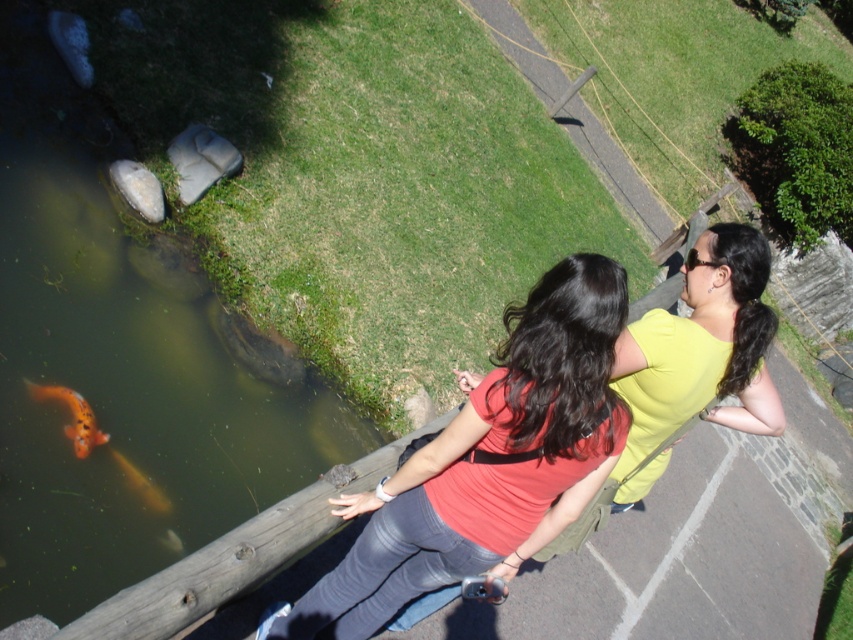
Question: Can you confirm if greenish murky water at lower left is smaller than matte red shirt at center?

Choices:
 (A) yes
 (B) no

Answer: (B)

Question: Which of these objects is positioned closest to the orange glossy fish at lower left?

Choices:
 (A) orange shiny fish at lower left
 (B) greenish murky water at lower left

Answer: (A)

Question: Considering the real-world distances, which object is farthest from the matte red shirt at center?

Choices:
 (A) orange shiny fish at lower left
 (B) orange glossy fish at lower left
 (C) greenish murky water at lower left

Answer: (B)

Question: Is matte red shirt at center to the left of orange glossy fish at lower left from the viewer's perspective?

Choices:
 (A) yes
 (B) no

Answer: (B)

Question: Does matte red shirt at center appear on the left side of orange glossy fish at lower left?

Choices:
 (A) yes
 (B) no

Answer: (B)

Question: Considering the real-world distances, which object is closest to the greenish murky water at lower left?

Choices:
 (A) orange glossy fish at lower left
 (B) matte red shirt at center

Answer: (A)